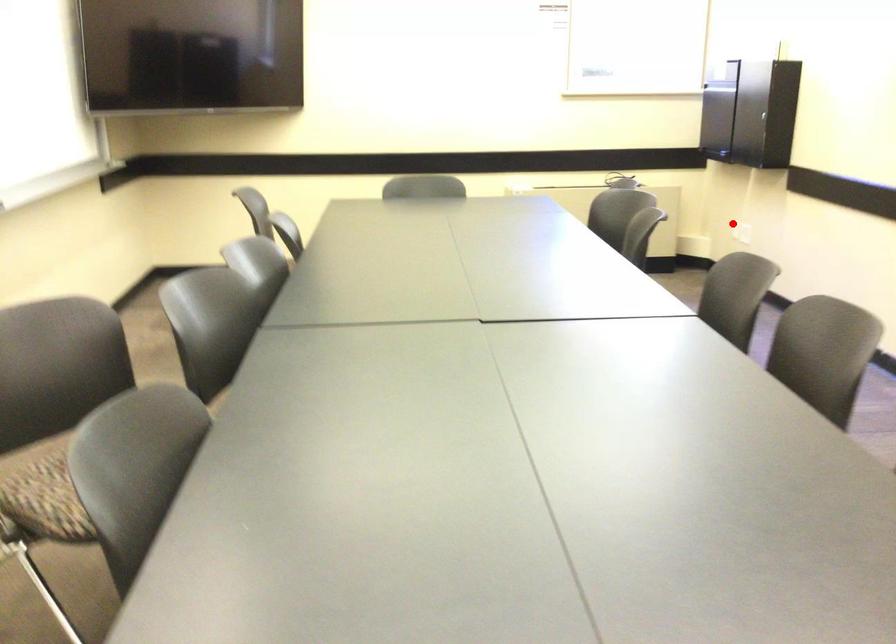
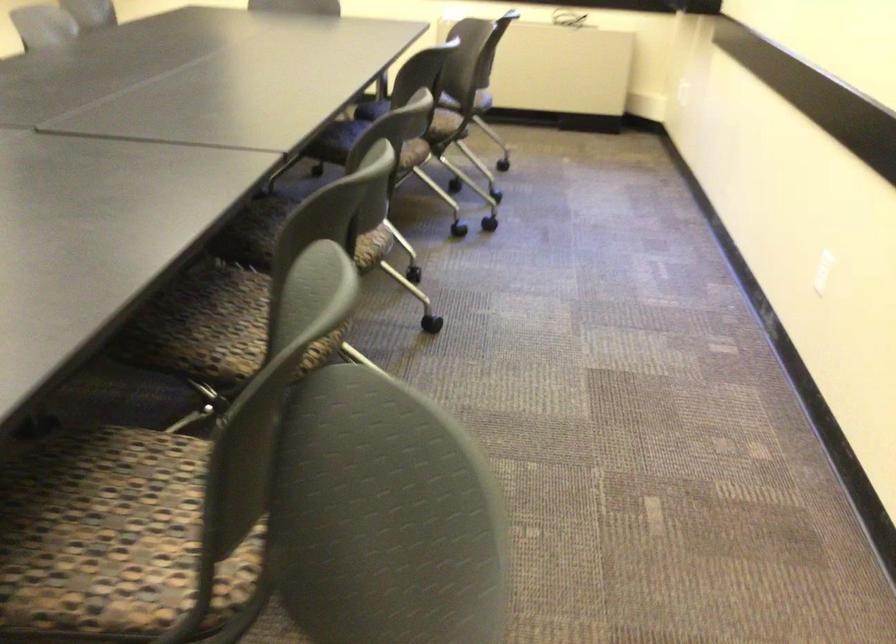
Where in the second image is the point corresponding to the highlighted location from the first image?

(682, 90)